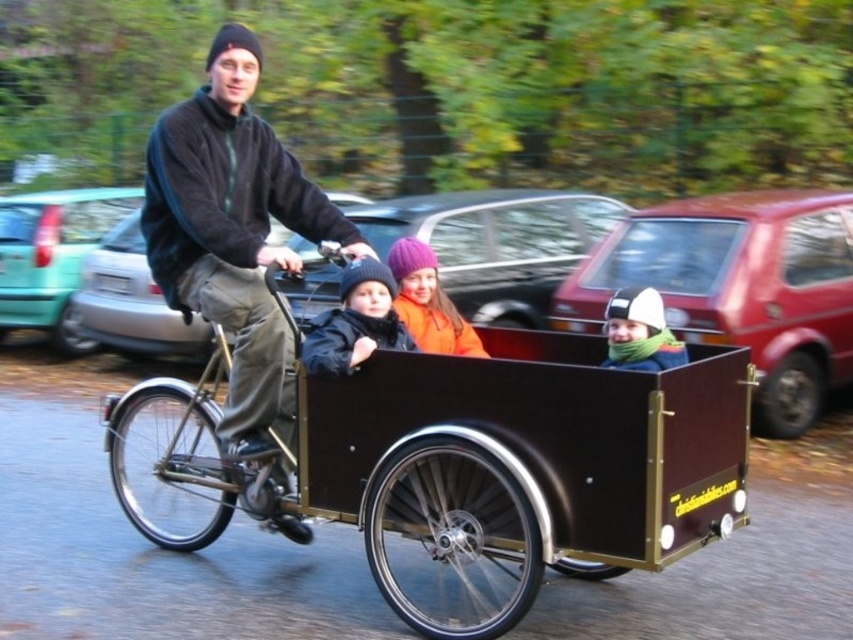
Question: Can you confirm if metallic silver car at center is bigger than teal matte car at left?

Choices:
 (A) yes
 (B) no

Answer: (A)

Question: Where is brown wooden wagon at center located in relation to metallic silver car at center in the image?

Choices:
 (A) left
 (B) right

Answer: (A)

Question: Which point is closer to the camera taking this photo?

Choices:
 (A) (549, 269)
 (B) (628, 397)
 (C) (843, 268)
 (D) (252, 228)

Answer: (B)

Question: Which point appears farthest from the camera in this image?

Choices:
 (A) (4, 250)
 (B) (471, 637)

Answer: (A)

Question: Which point appears closest to the camera in this image?

Choices:
 (A) (x=619, y=252)
 (B) (x=61, y=234)

Answer: (A)

Question: Can you confirm if metallic silver car at center is positioned above dark blue jacket at center?

Choices:
 (A) yes
 (B) no

Answer: (A)